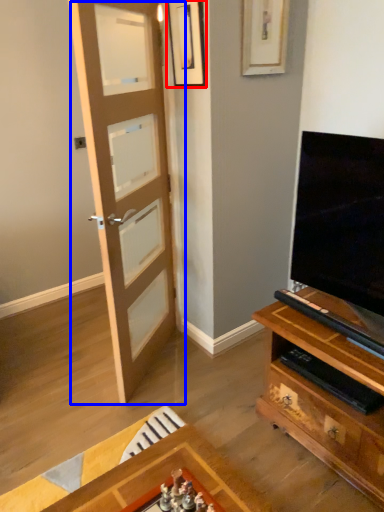
Question: Among these objects, which one is farthest to the camera, picture frame (highlighted by a red box) or door (highlighted by a blue box)?

Choices:
 (A) picture frame
 (B) door

Answer: (A)